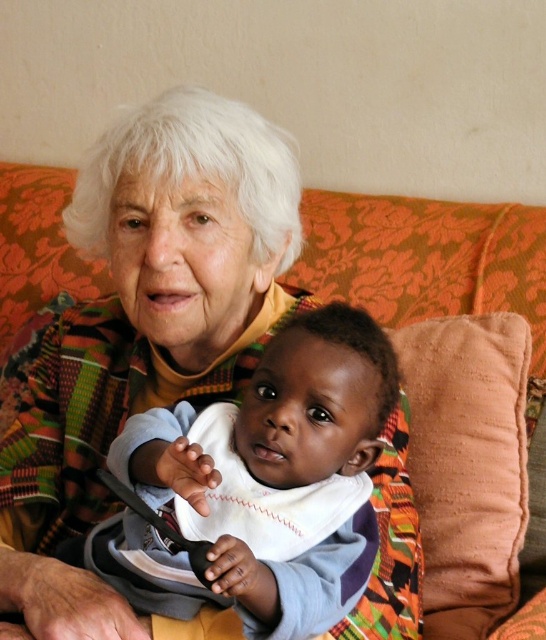
Is white soft bib at center smaller than coral velvety pillow at right?

No, white soft bib at center is not smaller than coral velvety pillow at right.

Is point (314, 577) more distant than point (525, 483)?

That is False.

At what (x,y) coordinates should I click in order to perform the action: click on white soft bib at center. Please return your answer as a coordinate pair (x, y). This screenshot has height=640, width=546. Looking at the image, I should click on (263, 484).

Is orange floral fabric couch at center wider than coral velvety pillow at right?

Indeed, orange floral fabric couch at center has a greater width compared to coral velvety pillow at right.

How far apart are orange floral fabric couch at center and coral velvety pillow at right?

They are 3.68 inches apart.

Which is behind, point (501, 248) or point (527, 339)?

The point (501, 248) is behind.

What are the coordinates of `orange floral fabric couch at center` in the screenshot? It's located at (426, 259).

Who is more distant from viewer, (x=221, y=448) or (x=482, y=291)?

The point (x=482, y=291) is behind.

At what (x,y) coordinates should I click in order to perform the action: click on white soft bib at center. Please return your answer as a coordinate pair (x, y). The height and width of the screenshot is (640, 546). Looking at the image, I should click on (263, 484).

Does point (327, 502) come in front of point (50, 289)?

Yes, point (327, 502) is closer to viewer.

At what (x,y) coordinates should I click in order to perform the action: click on white soft bib at center. Please return your answer as a coordinate pair (x, y). The width and height of the screenshot is (546, 640). Looking at the image, I should click on (263, 484).